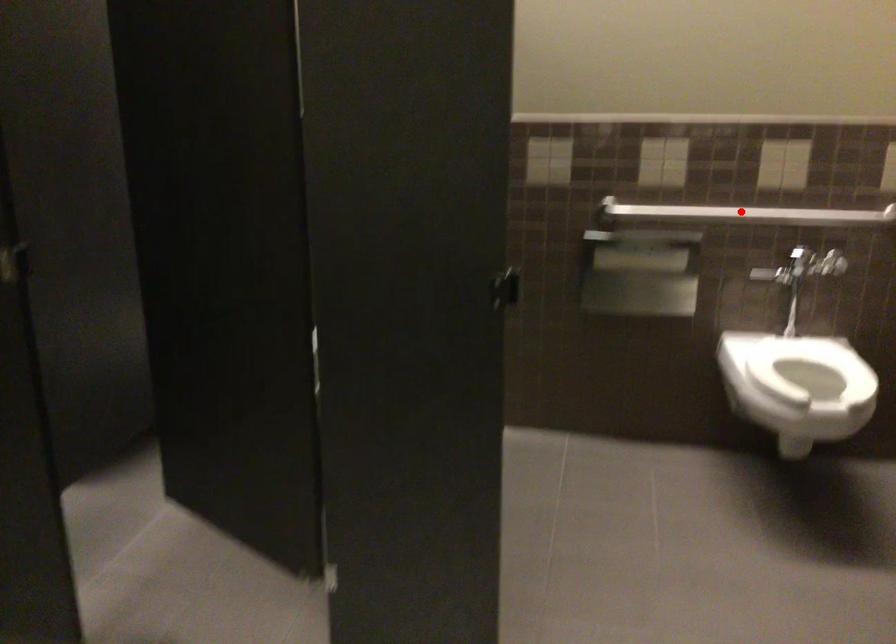
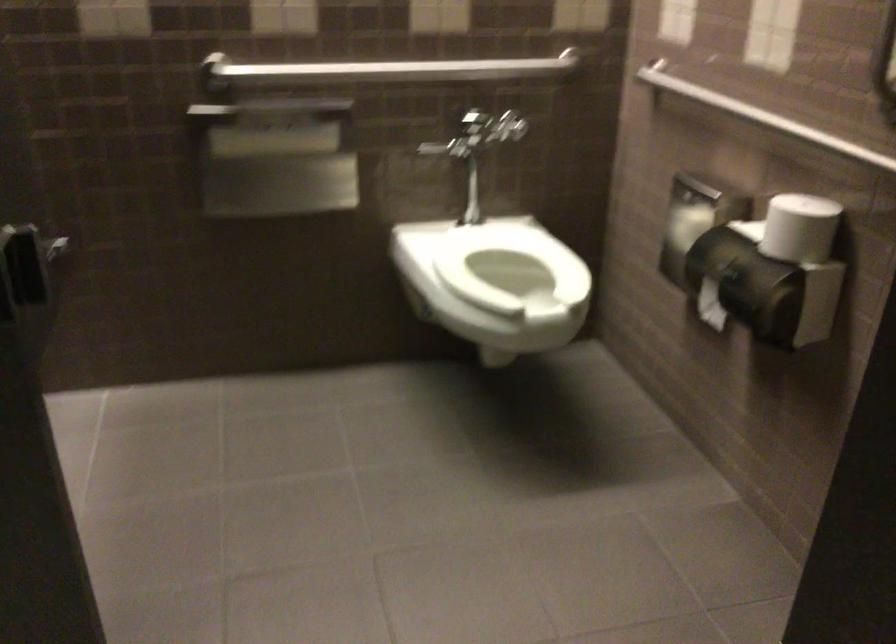
Question: I am providing you with two images of the same scene from different viewpoints. Image1 has a red point marked. In image2, the corresponding 3D location appears at what relative position? Reply with the corresponding letter.

Choices:
 (A) Closer
 (B) Farther

Answer: (A)